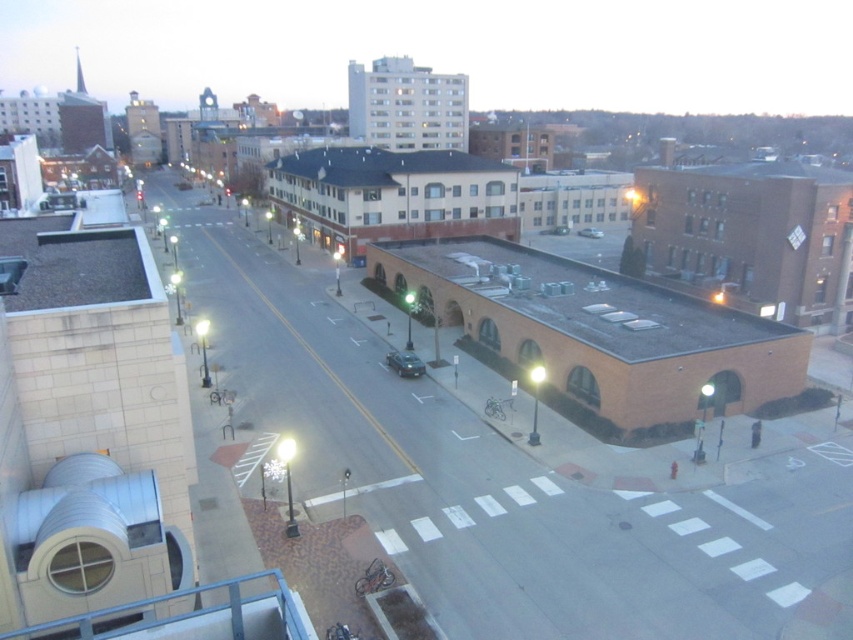
Is metallic silver car at center to the left of silver metallic sedan at center from the viewer's perspective?

Yes, metallic silver car at center is to the left of silver metallic sedan at center.

Between metallic silver car at center and silver metallic sedan at center, which one is positioned lower?

metallic silver car at center is lower down.

Image resolution: width=853 pixels, height=640 pixels. What do you see at coordinates (405, 364) in the screenshot? I see `metallic silver car at center` at bounding box center [405, 364].

Locate an element on the screen. metallic silver car at center is located at coordinates (405, 364).